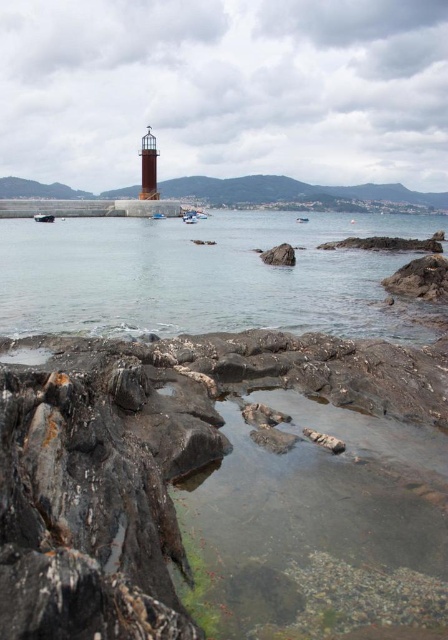
You are a photographer planning to capture the reflection of the blue plastic boat at center in the clear water at center. Based on the scene description, will the reflection be visible?

The clear water at center is positioned under blue plastic boat at center, so the reflection of the blue plastic boat at center should be visible in the clear water at center as reflections typically form on the surface of water beneath objects.

You are a photographer planning to capture the white plastic boat at center and the blue plastic boat at center in your shot. Which boat should you focus on if you want to highlight the one that is closer to the camera?

The white plastic boat at center is positioned over the blue plastic boat at center, meaning it is closer to the camera. Therefore, focusing on the white plastic boat at center will highlight the closer one.